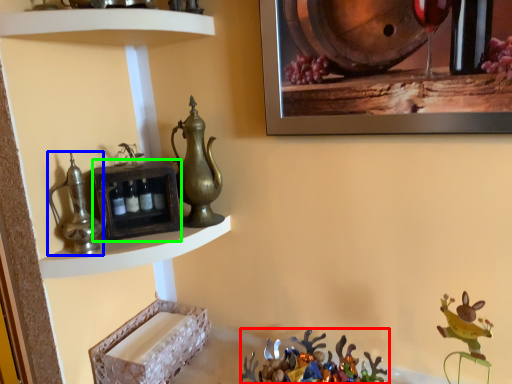
Question: Which is nearer to the christmas decoration (highlighted by a red box)? jug (highlighted by a blue box) or shelf (highlighted by a green box).

Choices:
 (A) jug
 (B) shelf

Answer: (B)